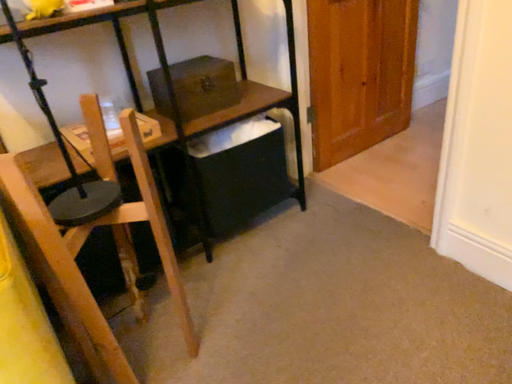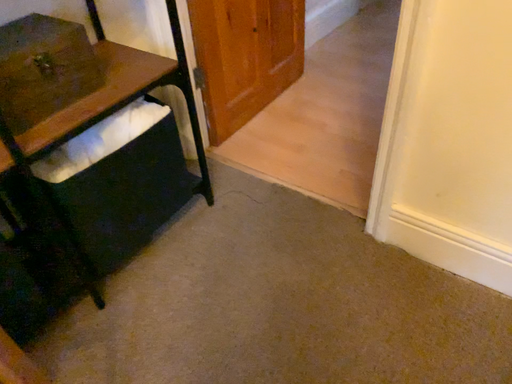
Question: Which way did the camera rotate in the video?

Choices:
 (A) rotated upward
 (B) rotated downward

Answer: (B)